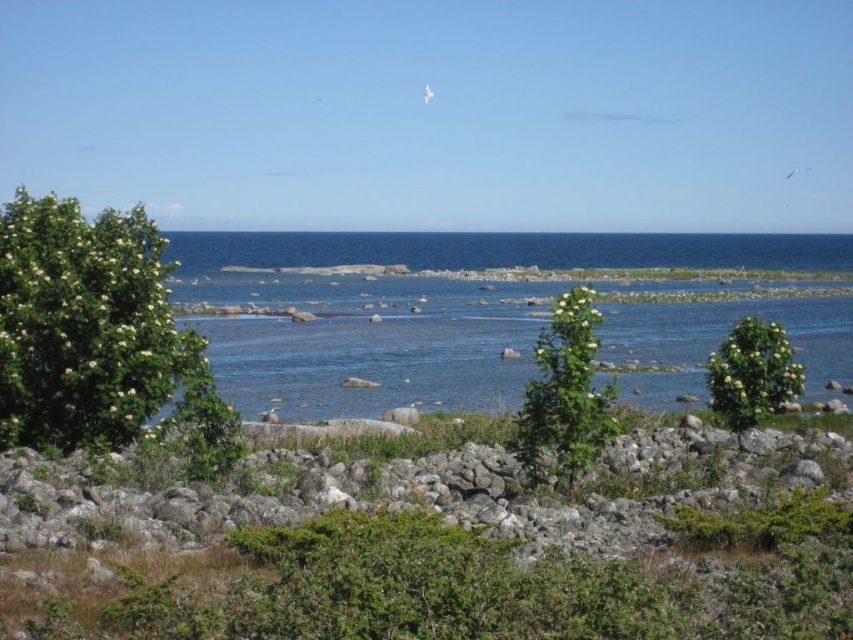
Question: Does green leafy bush at left have a lesser width compared to green leafy shrub at center?

Choices:
 (A) yes
 (B) no

Answer: (B)

Question: Which object is closer to the camera taking this photo?

Choices:
 (A) green leafy bush at left
 (B) green leafy shrub at center
 (C) green leafy bush at center
 (D) clear blue water at center

Answer: (B)

Question: Can you confirm if clear blue water at center is bigger than green leafy bush at center?

Choices:
 (A) yes
 (B) no

Answer: (A)

Question: Which object is the farthest from the clear blue water at center?

Choices:
 (A) gray rock at center
 (B) green leafy bush at left
 (C) green leafy bush at center

Answer: (C)

Question: Which object is farther from the camera taking this photo?

Choices:
 (A) green leafy bush at left
 (B) green leafy bush at center

Answer: (B)

Question: Is green leafy shrub at center bigger than green leafy bush at center?

Choices:
 (A) yes
 (B) no

Answer: (B)